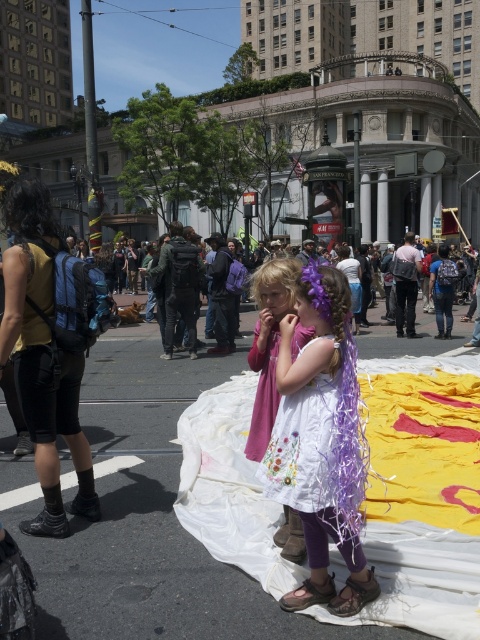
You are a photographer trying to capture the two girls standing on the white fabric at center and wearing the white satin dress at center. To ensure the dress is clearly visible against the fabric, which one should you focus on more?

The white satin dress at center should be focused on more since it is positioned above the white fabric at center, making it stand out better.

You are a photographer trying to capture both the white satin dress at center and the white cotton dress at center in a single shot. Since you can only focus on one dress at a time, which dress should you focus on to ensure the other is still in the background?

The white satin dress at center is located below the white cotton dress at center, so focusing on the white cotton dress at center will keep the white satin dress at center in the background.

You are a photographer trying to capture both the white embroidered dress at center and the white cotton dress at center in a single shot. Which dress should you focus on first to ensure it appears sharp in the photo?

You should focus on the white embroidered dress at center first because it is closer to the viewer, ensuring it will be sharp while the white cotton dress at center may appear slightly blurry due to its distance.